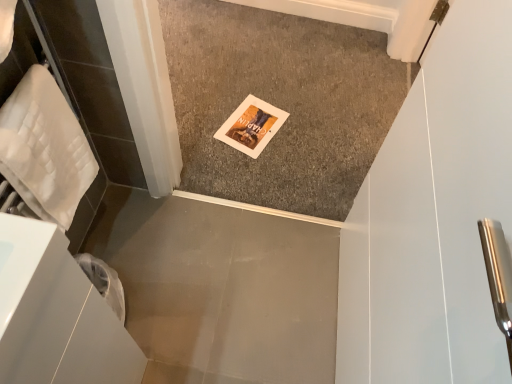
Question: Considering the relative positions of carpeted floor at center, positioned as the first concrete in back-to-front order, and smooth gray concrete at lower left, which is the first concrete from front to back, in the image provided, is carpeted floor at center, positioned as the first concrete in back-to-front order, to the left of smooth gray concrete at lower left, which is the first concrete from front to back, from the viewer's perspective?

Choices:
 (A) yes
 (B) no

Answer: (B)

Question: Considering the relative positions of carpeted floor at center, the 1th concrete from the top, and smooth gray concrete at lower left, arranged as the 2th concrete when viewed from the top, in the image provided, is carpeted floor at center, the 1th concrete from the top, to the right of smooth gray concrete at lower left, arranged as the 2th concrete when viewed from the top, from the viewer's perspective?

Choices:
 (A) no
 (B) yes

Answer: (B)

Question: From the image's perspective, is carpeted floor at center, which ranks as the 2th concrete in bottom-to-top order, over smooth gray concrete at lower left, arranged as the 2th concrete when viewed from the top?

Choices:
 (A) yes
 (B) no

Answer: (A)

Question: From a real-world perspective, does carpeted floor at center, which is the 2th concrete from front to back, stand above smooth gray concrete at lower left, marked as the second concrete in a back-to-front arrangement?

Choices:
 (A) no
 (B) yes

Answer: (B)

Question: Is carpeted floor at center, which ranks as the 2th concrete in bottom-to-top order, positioned in front of smooth gray concrete at lower left, the 1th concrete ordered from the bottom?

Choices:
 (A) no
 (B) yes

Answer: (A)

Question: From their relative heights in the image, would you say white quilted towel at left is taller or shorter than smooth gray concrete at lower left, arranged as the 2th concrete when viewed from the top?

Choices:
 (A) short
 (B) tall

Answer: (B)

Question: From the image's perspective, is white quilted towel at left above or below smooth gray concrete at lower left, marked as the second concrete in a back-to-front arrangement?

Choices:
 (A) below
 (B) above

Answer: (B)

Question: Is white quilted towel at left situated inside smooth gray concrete at lower left, the 1th concrete ordered from the bottom, or outside?

Choices:
 (A) inside
 (B) outside

Answer: (B)

Question: Looking at their shapes, would you say white quilted towel at left is wider or thinner than smooth gray concrete at lower left, which is the first concrete from front to back?

Choices:
 (A) thin
 (B) wide

Answer: (A)

Question: In terms of height, does smooth gray concrete at lower left, arranged as the 2th concrete when viewed from the top, look taller or shorter compared to white quilted towel at left?

Choices:
 (A) tall
 (B) short

Answer: (B)

Question: Considering the positions of smooth gray concrete at lower left, which is the first concrete from front to back, and white quilted towel at left in the image, is smooth gray concrete at lower left, which is the first concrete from front to back, bigger or smaller than white quilted towel at left?

Choices:
 (A) small
 (B) big

Answer: (B)

Question: Relative to white quilted towel at left, is smooth gray concrete at lower left, which is the first concrete from front to back, in front or behind?

Choices:
 (A) behind
 (B) front

Answer: (A)

Question: Do you think smooth gray concrete at lower left, marked as the second concrete in a back-to-front arrangement, is within white quilted towel at left, or outside of it?

Choices:
 (A) inside
 (B) outside

Answer: (B)

Question: From the image's perspective, relative to carpeted floor at center, the 1th concrete from the top, is white quilted towel at left above or below?

Choices:
 (A) below
 (B) above

Answer: (A)

Question: From a real-world perspective, is white quilted towel at left positioned above or below carpeted floor at center, positioned as the first concrete in back-to-front order?

Choices:
 (A) below
 (B) above

Answer: (B)